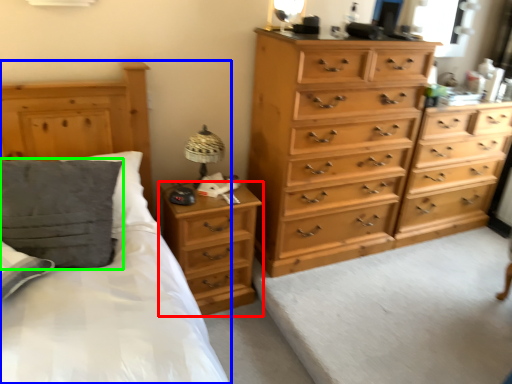
Question: Estimate the real-world distances between objects in this image. Which object is closer to nightstand (highlighted by a red box), bed (highlighted by a blue box) or pillow (highlighted by a green box)?

Choices:
 (A) bed
 (B) pillow

Answer: (A)